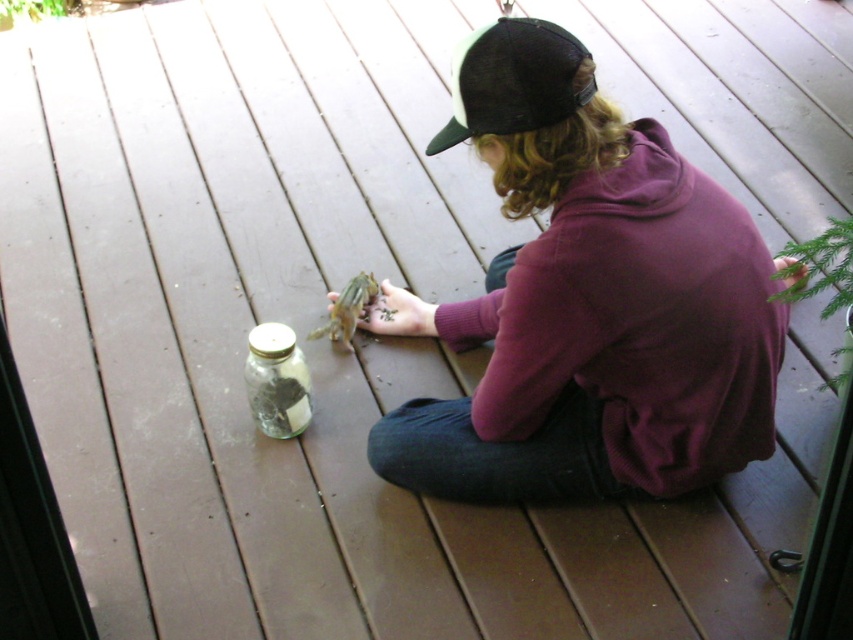
You are a photographer trying to capture the clear glass jar at center in your shot. The black leather cap at upper center is blocking your view. Can you move the cap to the side to get a better angle?

The black leather cap at upper center is located above the clear glass jar at center, so moving the cap downward or to the side would allow you to see the jar clearly.

You are a wildlife photographer trying to capture a closeup shot of the green matte chipmunk at center. You have a lens that can focus on objects within 10cm. The black leather cap at upper center is blocking your view. How can you adjust your position to get the shot without moving the cap?

Since the black leather cap at upper center is larger than the green matte chipmunk at center, you can move your camera slightly to the side so that the smaller chipmunk is visible around the edge of the cap while keeping the cap between you and the larger obstruction.